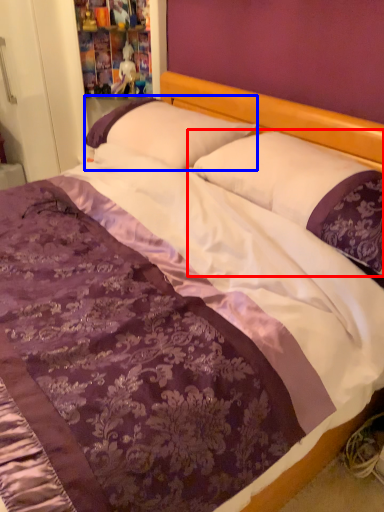
Question: Which of the following is the closest to the observer, pillow (highlighted by a red box) or pillow (highlighted by a blue box)?

Choices:
 (A) pillow
 (B) pillow

Answer: (A)